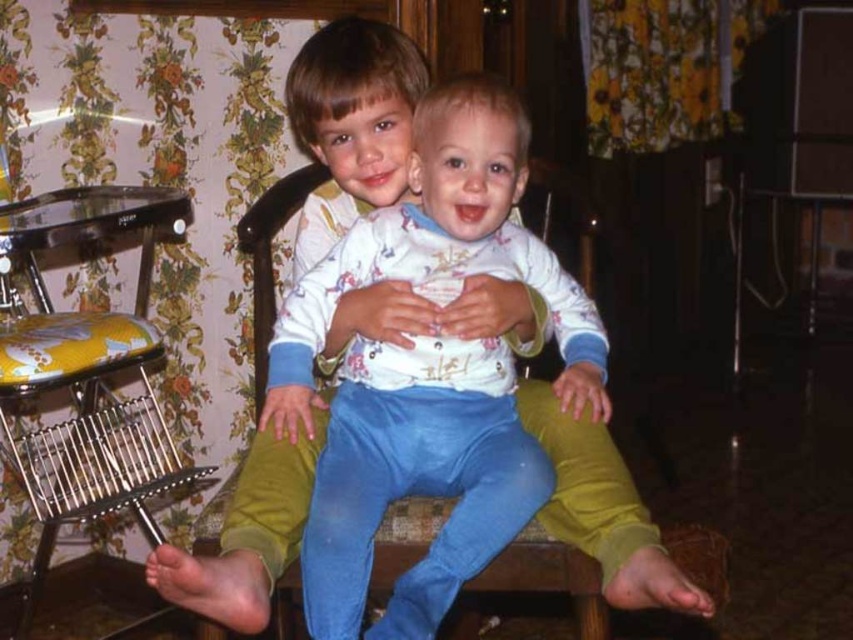
You are a photographer setting up for a family portrait. You see a white cotton shirt at center and a yellow fabric rocking chair at left. Which object is positioned to the right of the other?

The white cotton shirt at center is positioned to the right of the yellow fabric rocking chair at left according to the description.

You are a photographer setting up for a family photo. You need to ensure that the white cotton shirt at center and the yellow fabric rocking chair at left are both visible in the frame. Given their sizes, which object should you focus on first to ensure they are both in focus?

The white cotton shirt at center is smaller than the yellow fabric rocking chair at left, so you should focus on the yellow fabric rocking chair at left first to ensure both are in focus, as it is larger and requires more attention to detail.